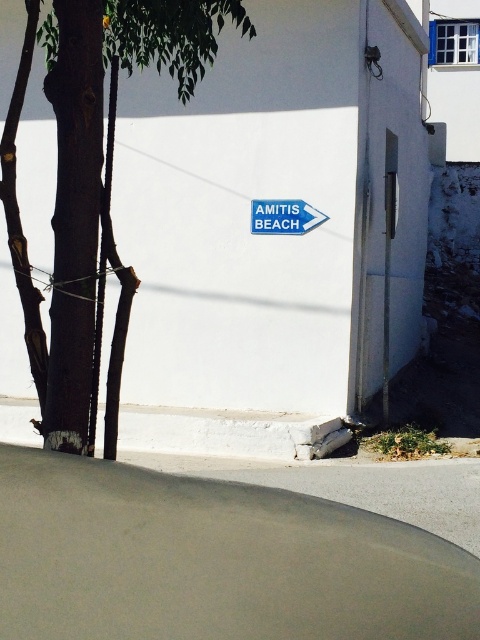
You are standing on the street corner and see the brown rough bark at left and the blue plastic sign at center. Which object is taller?

The brown rough bark at left is much taller than the blue plastic sign at center.

You are walking on the street and see the brown rough bark at left and the blue plastic sign at center. Which object is closer to you?

The brown rough bark at left is closer to you because it is in front of the blue plastic sign at center.

You are a painter who wants to paint both the brown rough bark at left and the blue plastic sign at center. Which object requires a wider brush stroke to cover its entire width?

The brown rough bark at left requires a wider brush stroke because its width is larger than the blue plastic sign at center.